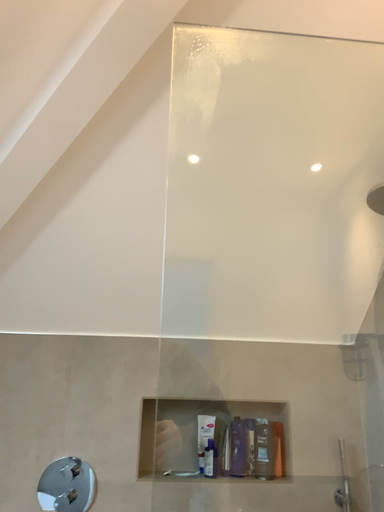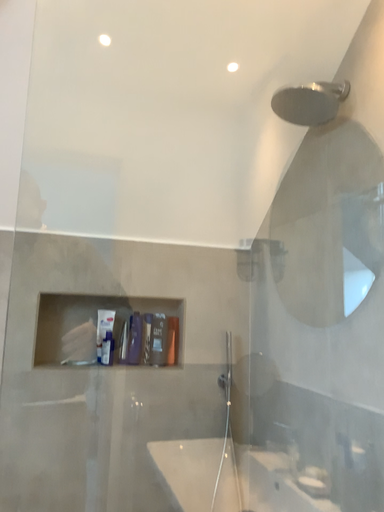
Question: Which way did the camera rotate in the video?

Choices:
 (A) rotated right
 (B) rotated left

Answer: (A)